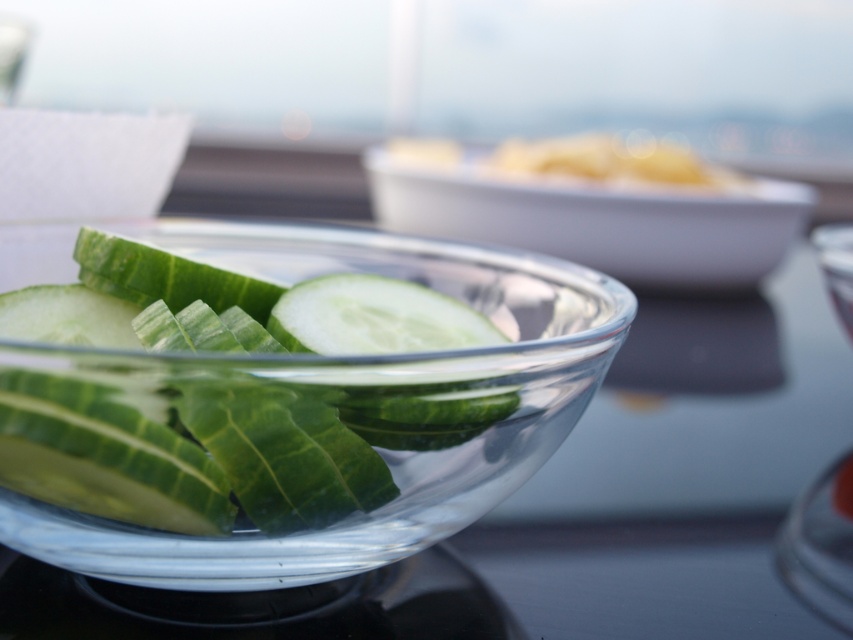
Can you confirm if transparent glass bowl at center is smaller than clear glass bowl at center?

Correct, transparent glass bowl at center occupies less space than clear glass bowl at center.

Who is lower down, transparent glass bowl at center or clear glass bowl at center?

transparent glass bowl at center

Locate an element on the screen. transparent glass bowl at center is located at coordinates (296, 420).

Identify the location of transparent glass bowl at center. This screenshot has width=853, height=640. (296, 420).